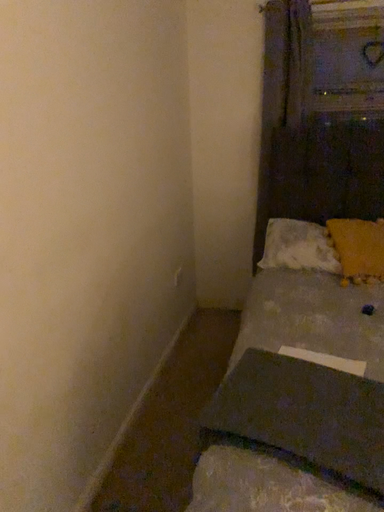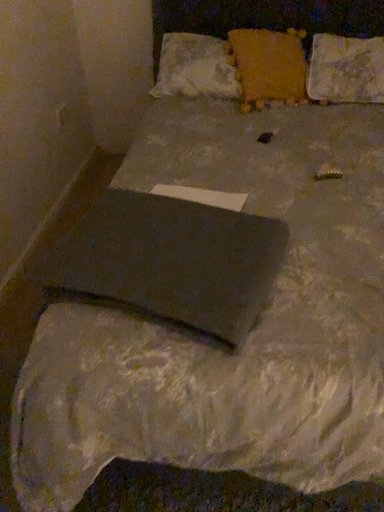
Question: Which way did the camera rotate in the video?

Choices:
 (A) rotated left
 (B) rotated right

Answer: (B)